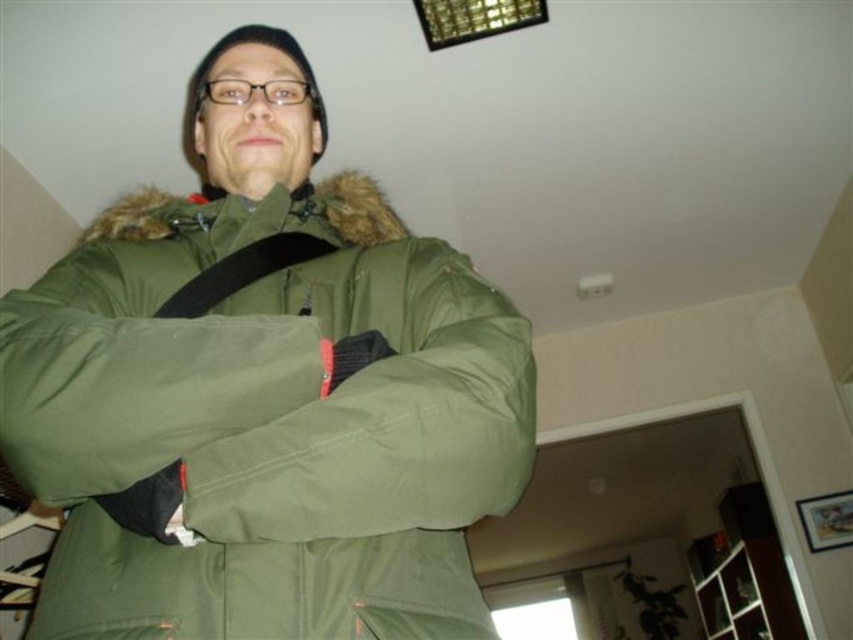
You are trying to determine if the green matte jacket at center can fit through a narrow doorway. The black fabric strap at center is hanging loosely from the jacket. Based on their sizes, do you think the jacket can pass through the doorway without getting stuck?

The green matte jacket at center might be wider than black fabric strap at center, so there is a possibility that the jacket could get stuck in the doorway if it is too narrow. The strap itself is likely too narrow to cause any issues, but the jacket may need to be adjusted or folded to fit through.

You are a tailor who needs to determine which item takes up more space in the room. Based on the image, which object is larger in size between the green matte jacket at center and the black fabric strap at center?

The green matte jacket at center has a larger size compared to the black fabric strap at center, so the green matte jacket at center takes up more space.

You are a photographer who needs to take a photo of the green matte jacket at center. You have a camera that requires a minimum distance of 18 inches to focus properly. Can you take a clear photo from your current position?

The green matte jacket at center and camera are 17.80 inches apart from each other. Since the minimum focusing distance is 18 inches, the camera cannot focus properly at this distance, so you cannot take a clear photo from your current position.